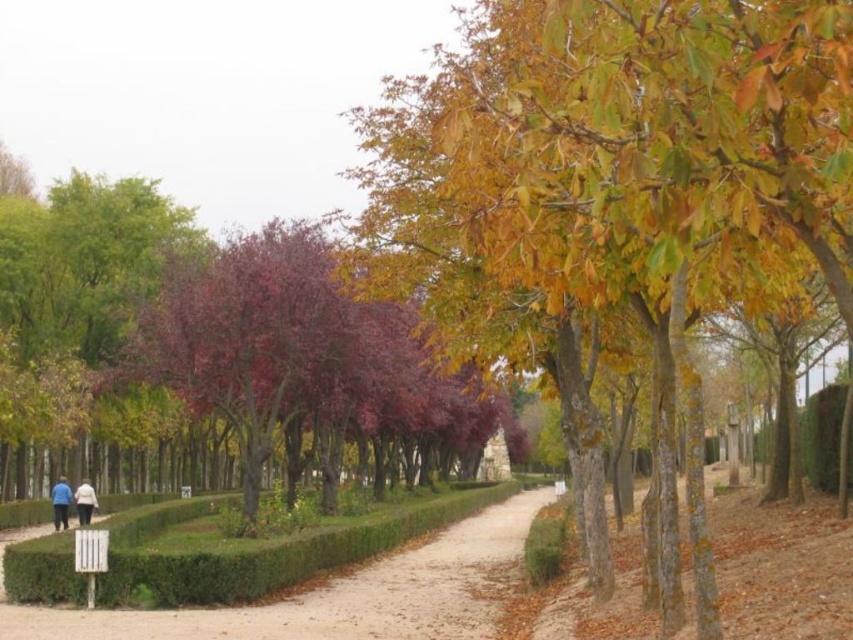
Question: Which object is farther from the camera taking this photo?

Choices:
 (A) blue fabric jacket at lower left
 (B) white fabric person at lower left
 (C) green hedge at lower left
 (D) yellow-green bark tree at center-right

Answer: (A)

Question: Observing the image, what is the correct spatial positioning of yellow-green bark tree at center-right in reference to blue fabric jacket at lower left?

Choices:
 (A) right
 (B) left

Answer: (A)

Question: Does blue fabric jacket at lower left appear on the right side of white fabric person at lower left?

Choices:
 (A) no
 (B) yes

Answer: (A)

Question: Based on their relative distances, which object is farther from the yellow-green bark tree at center-right?

Choices:
 (A) blue fabric jacket at lower left
 (B) green hedge at lower left
 (C) white fabric person at lower left
 (D) light blue fabric couple at lower left

Answer: (A)

Question: Can you confirm if purple glossy tree at center is thinner than white fabric person at lower left?

Choices:
 (A) yes
 (B) no

Answer: (B)

Question: Considering the real-world distances, which object is closest to the blue fabric jacket at lower left?

Choices:
 (A) yellow-green bark tree at center-right
 (B) green hedge at lower left
 (C) purple glossy tree at center
 (D) light blue fabric couple at lower left

Answer: (D)